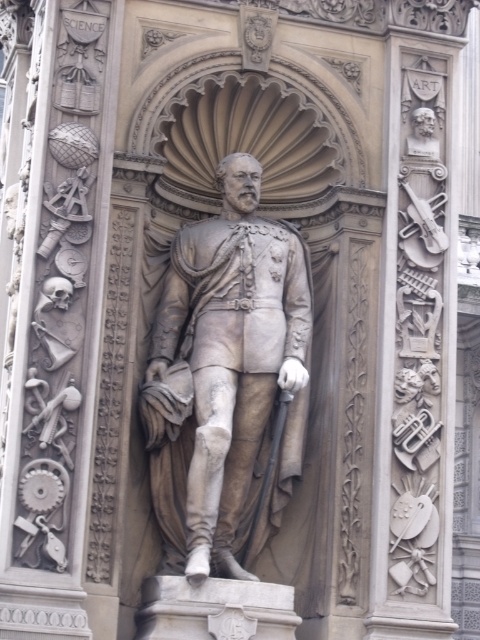
You are an art conservator assessing the placement of the gray stone statue at center and the gray stone bust at upper right. Which object is positioned higher up in the image?

The gray stone bust at upper right is positioned higher up in the image than the gray stone statue at center.

You are an art conservator examining the statue. You notice two points on the statue marked at coordinates point [225,369] and point [420,120]. Which point is nearer to your current position as you face the statue?

Point [225,369] is closer to the viewer than point [420,120], so the first point is nearer to your current position.